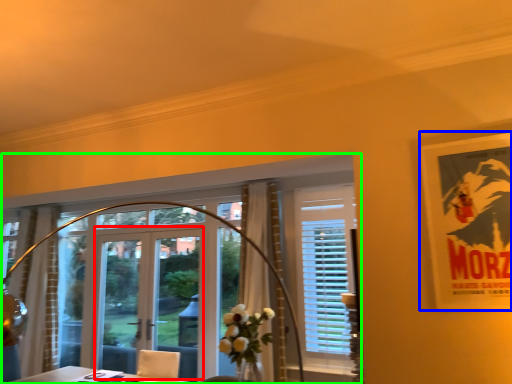
Question: Which is farther away from screen door (highlighted by a red box)? poster page (highlighted by a blue box) or window (highlighted by a green box)?

Choices:
 (A) poster page
 (B) window

Answer: (A)